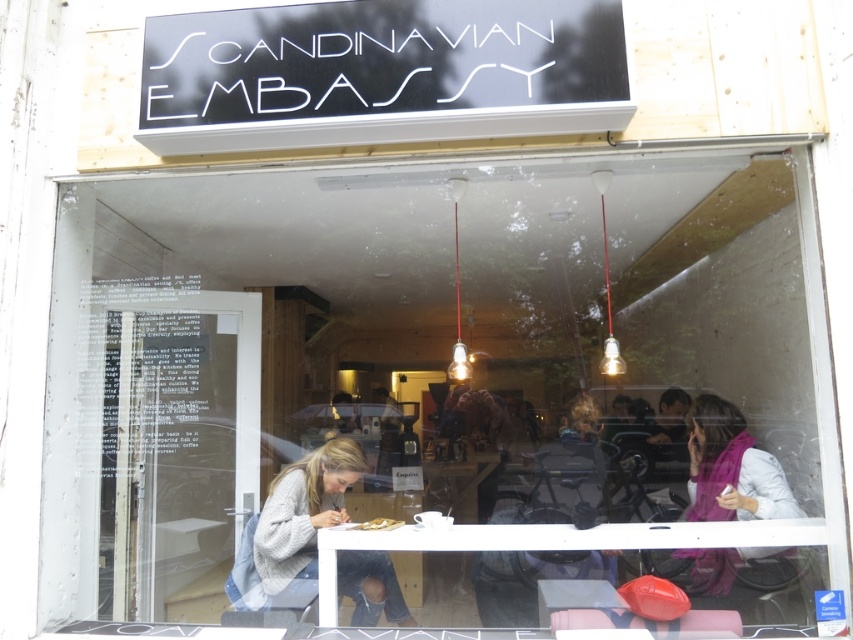
Is transparent glass door at center thinner than white matte plate at center?

In fact, transparent glass door at center might be wider than white matte plate at center.

Is point (97, 289) closer to viewer compared to point (396, 524)?

No, it is behind (396, 524).

Identify the location of transparent glass door at center. (173, 444).

Which is above, transparent glass door at center or purple scarf at right?

Positioned higher is transparent glass door at center.

In the scene shown: Can you confirm if transparent glass door at center is thinner than purple scarf at right?

Correct, transparent glass door at center's width is less than purple scarf at right's.

Does point (225, 433) lie behind point (695, 548)?

Yes.

This screenshot has width=853, height=640. I want to click on transparent glass door at center, so click(x=173, y=444).

Based on the photo, which is below, knitted gray sweater at center or white matte plate at center?

knitted gray sweater at center is lower down.

Measure the distance between knitted gray sweater at center and camera.

2.90 meters

Measure the distance between knitted gray sweater at center and camera.

They are 2.90 meters apart.

Image resolution: width=853 pixels, height=640 pixels. I want to click on knitted gray sweater at center, so click(303, 512).